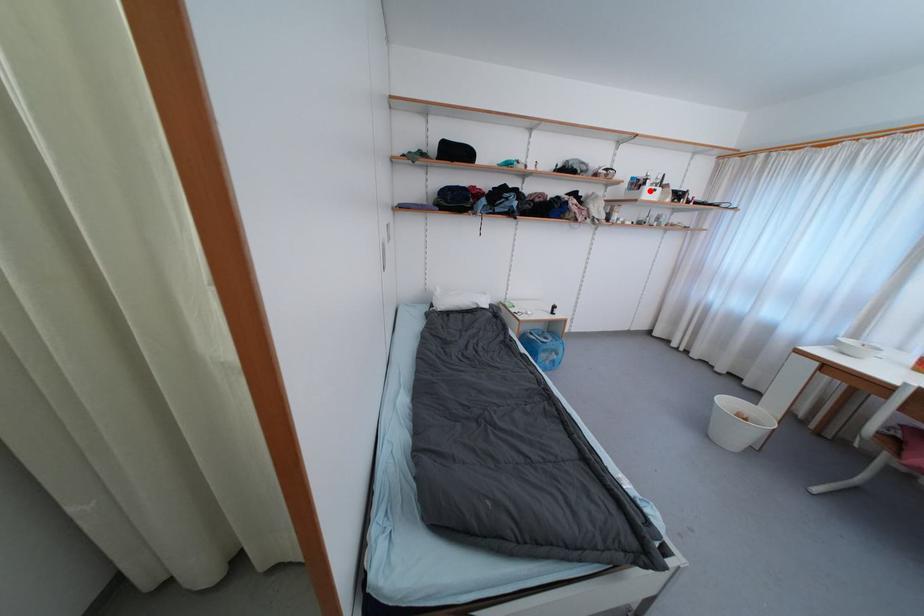
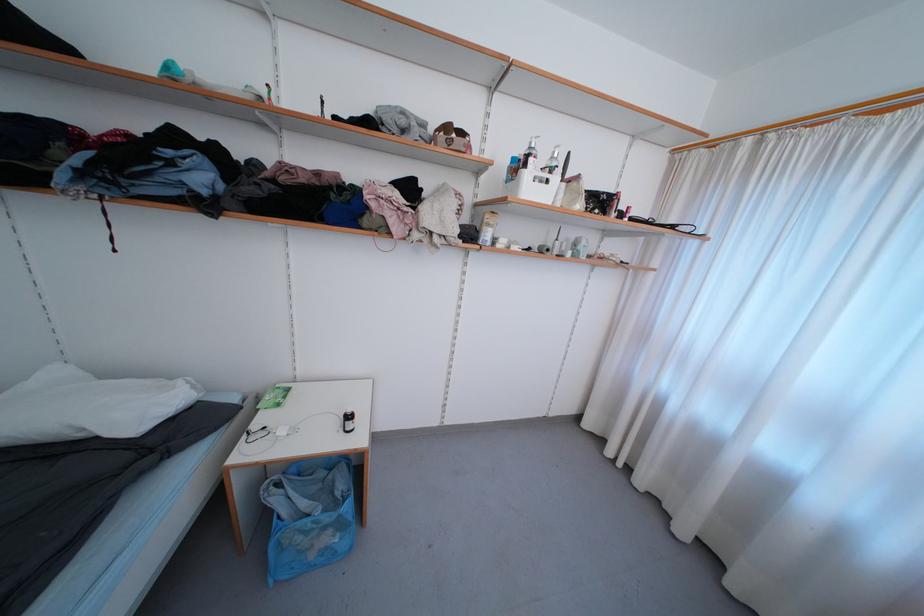
In the second image, find the point that corresponds to the highlighted location in the first image.

(531, 177)